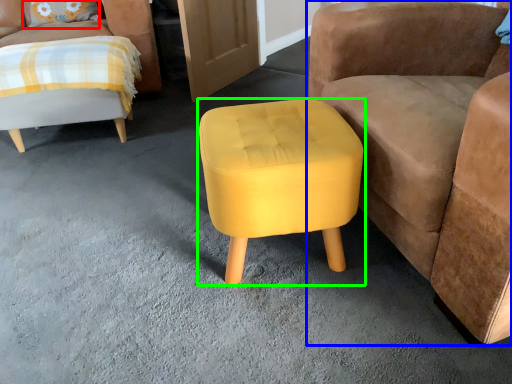
Question: Which object is the closest to the pillow (highlighted by a red box)? Choose among these: chair (highlighted by a blue box) or stool (highlighted by a green box).

Choices:
 (A) chair
 (B) stool

Answer: (B)